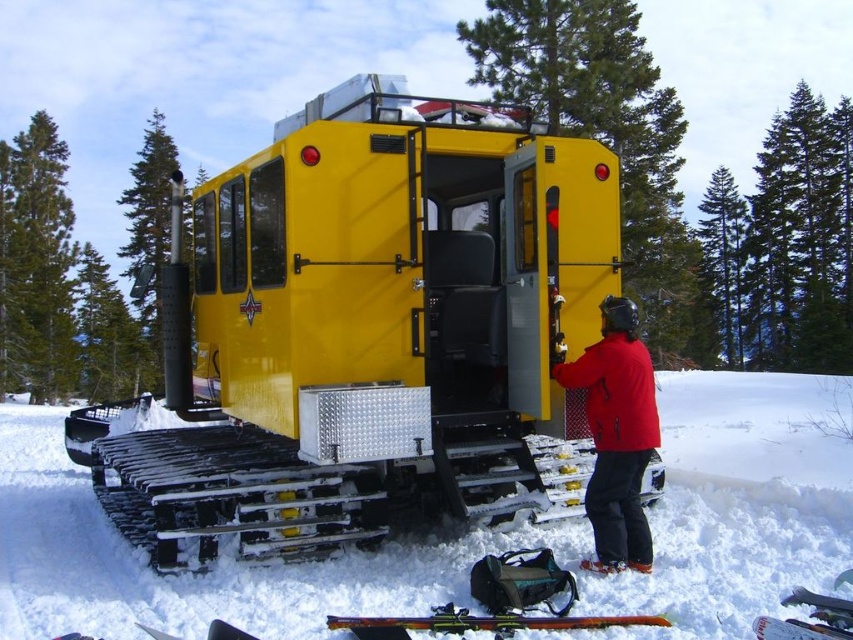
Question: From the image, what is the correct spatial relationship of white powdery snow at center in relation to red matte jacket at center?

Choices:
 (A) above
 (B) below

Answer: (B)

Question: Which point is farther from the camera taking this photo?

Choices:
 (A) (850, 522)
 (B) (628, 474)
 (C) (657, 476)

Answer: (C)

Question: Among these points, which one is farthest from the camera?

Choices:
 (A) (599, 340)
 (B) (294, 481)
 (C) (231, 577)

Answer: (A)

Question: From the image, what is the correct spatial relationship of white powdery snow at center in relation to red matte jacket at center?

Choices:
 (A) below
 (B) above

Answer: (A)

Question: Where is white powdery snow at center located in relation to red matte jacket at center in the image?

Choices:
 (A) above
 (B) below

Answer: (B)

Question: Which of the following is the closest to the observer?

Choices:
 (A) red matte jacket at center
 (B) yellow metallic train car at center

Answer: (A)